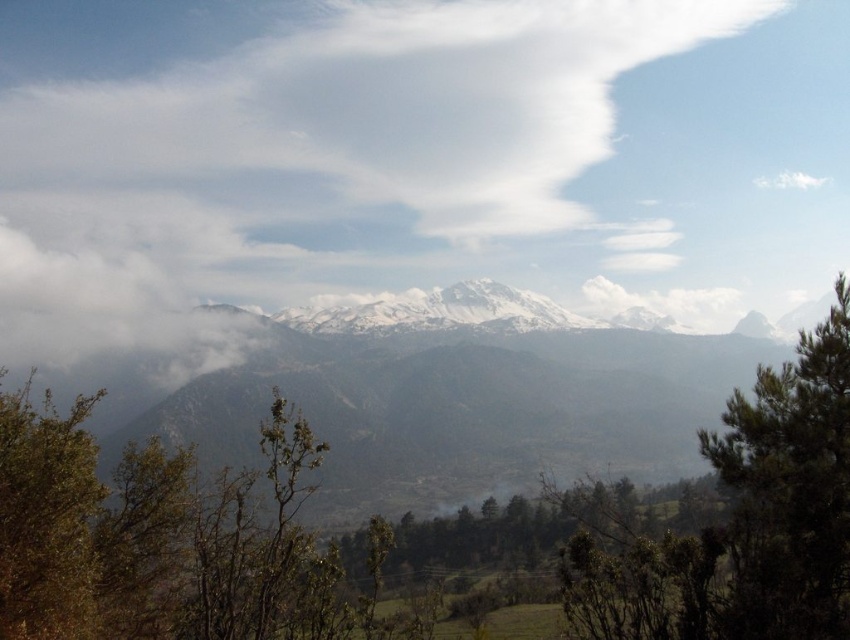
Which of these two, snowy rock mountain range at center or white snow-covered peak at upper center, stands taller?

snowy rock mountain range at center is taller.

Is snowy rock mountain range at center positioned in front of white snow-covered peak at upper center?

That is True.

Is point (485, 385) farther from viewer compared to point (743, 316)?

No, (485, 385) is closer to viewer.

Where is `snowy rock mountain range at center`? snowy rock mountain range at center is located at coordinates (463, 406).

Between green leafy tree at lower left and green leafy tree at right, which one has more height?

green leafy tree at lower left

What do you see at coordinates (163, 540) in the screenshot? This screenshot has width=850, height=640. I see `green leafy tree at lower left` at bounding box center [163, 540].

Between point (225, 624) and point (768, 586), which one is positioned in front?

Point (768, 586) is more forward.

Locate an element on the screen. The height and width of the screenshot is (640, 850). green leafy tree at lower left is located at coordinates (163, 540).

Does green leafy tree at right have a larger size compared to white snow-covered peak at upper center?

Yes, green leafy tree at right is bigger than white snow-covered peak at upper center.

Is the position of green leafy tree at right less distant than that of white snow-covered peak at upper center?

Yes.

Locate an element on the screen. The image size is (850, 640). green leafy tree at right is located at coordinates (790, 490).